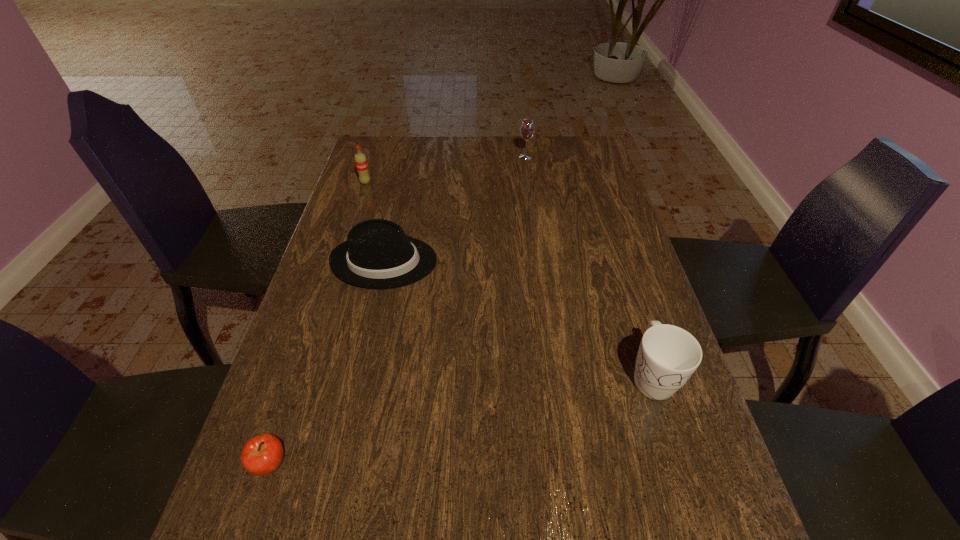
This screenshot has width=960, height=540. What are the coordinates of `blank space at the right edge of the desktop` in the screenshot? It's located at (653, 441).

Identify the location of vacant space at the far left corner of the desktop. (367, 145).

Where is `free point between the mug and the fedora`? free point between the mug and the fedora is located at coordinates (517, 319).

Locate an element on the screen. This screenshot has height=540, width=960. vacant area between the wineglass and the nearest object is located at coordinates pos(397,310).

The image size is (960, 540). Identify the location of vacant area between the rightmost object and the fourth nearest object. (508, 279).

Locate an element on the screen. vacant region between the mug and the fourth object from left to right is located at coordinates (588, 266).

Find the location of a particular element. Image resolution: width=960 pixels, height=540 pixels. free space between the shortest object and the second shortest object is located at coordinates (327, 363).

The height and width of the screenshot is (540, 960). Identify the location of vacant area that lies between the second object from right to left and the shortest object. (397, 310).

Locate an element on the screen. This screenshot has width=960, height=540. object that can be found as the third closest to the nearest object is located at coordinates (361, 163).

Identify which object is located as the fourth nearest to the wineglass. Please provide its 2D coordinates. Your answer should be formatted as a tuple, i.e. [(x, y)], where the tuple contains the x and y coordinates of a point satisfying the conditions above.

[(262, 455)]